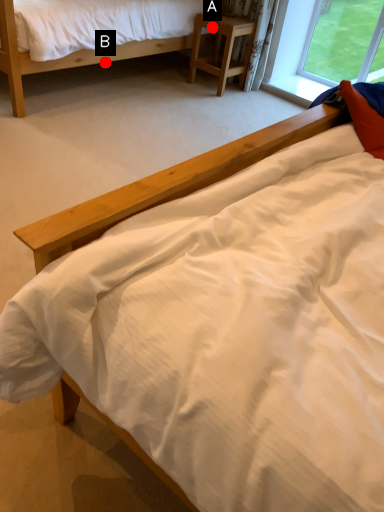
Question: Two points are circled on the image, labeled by A and B beside each circle. Which point is closer to the camera?

Choices:
 (A) A is closer
 (B) B is closer

Answer: (B)